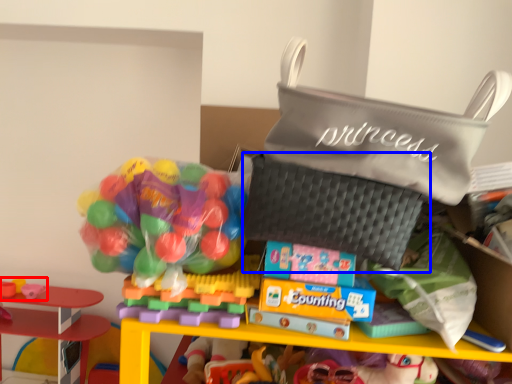
Question: Which object appears farthest to the camera in this image, toy (highlighted by a red box) or pouch (highlighted by a blue box)?

Choices:
 (A) toy
 (B) pouch

Answer: (A)